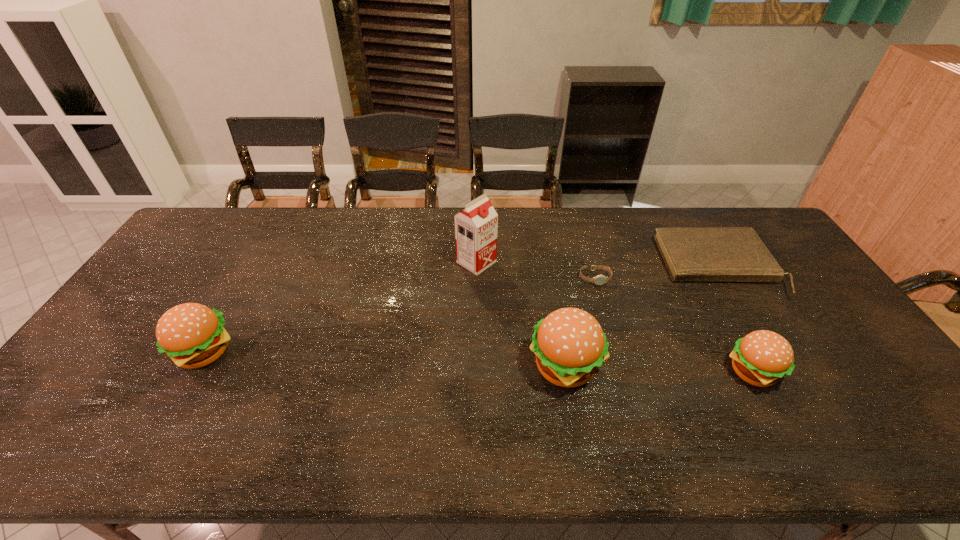
The width and height of the screenshot is (960, 540). Find the location of `vacant region at the left edge of the desktop`. vacant region at the left edge of the desktop is located at coordinates (178, 263).

Image resolution: width=960 pixels, height=540 pixels. I want to click on free location at the right edge of the desktop, so click(809, 310).

Locate an element on the screen. This screenshot has width=960, height=540. vacant area that lies between the second hamburger from right to left and the tallest object is located at coordinates coord(521,314).

Identify the location of blank region between the watch and the rightmost hamburger. [674, 325].

This screenshot has height=540, width=960. What are the coordinates of `empty space that is in between the second hamburger from left to right and the paperback book` in the screenshot? It's located at (x=641, y=316).

This screenshot has width=960, height=540. I want to click on vacant space that is in between the second hamburger from right to left and the second tallest hamburger, so click(x=385, y=360).

This screenshot has width=960, height=540. I want to click on free spot between the soya milk and the rightmost hamburger, so click(615, 317).

Identify the location of free space between the leftmost object and the shortest object. (399, 316).

The image size is (960, 540). What are the coordinates of `free space between the tallest object and the shortest hamburger` in the screenshot? It's located at (615, 317).

The width and height of the screenshot is (960, 540). I want to click on vacant area that lies between the paperback book and the shortest object, so click(657, 273).